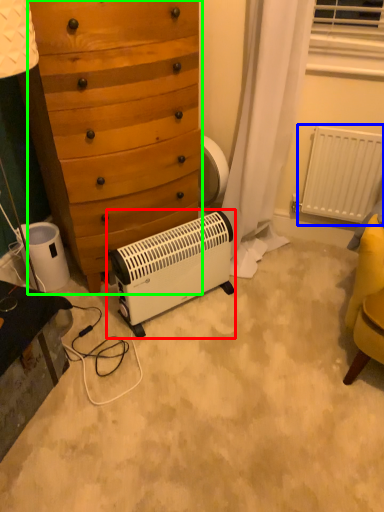
Question: Which is farther away from home appliance (highlighted by a red box)? radiator (highlighted by a blue box) or chest of drawers (highlighted by a green box)?

Choices:
 (A) radiator
 (B) chest of drawers

Answer: (A)